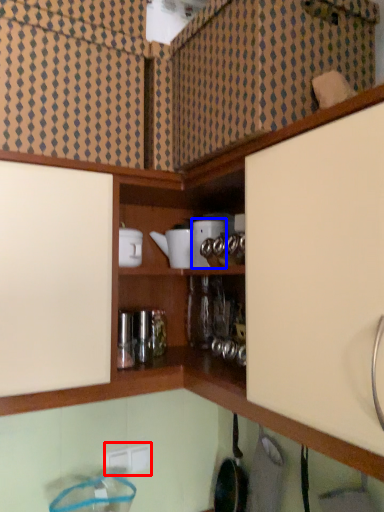
Question: Among these objects, which one is farthest to the camera, electric outlet (highlighted by a red box) or appliance (highlighted by a blue box)?

Choices:
 (A) electric outlet
 (B) appliance

Answer: (A)